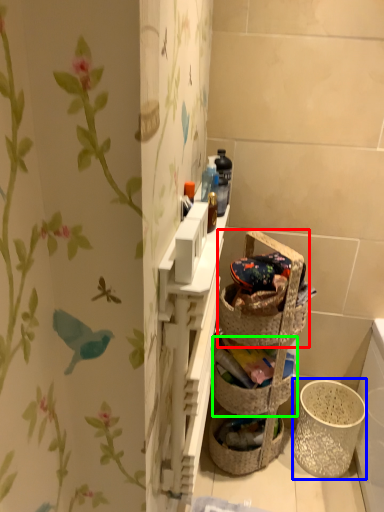
Question: Considering the real-world distances, which object is closest to picnic basket (highlighted by a red box)? basket container (highlighted by a blue box) or basket container (highlighted by a green box).

Choices:
 (A) basket container
 (B) basket container

Answer: (B)